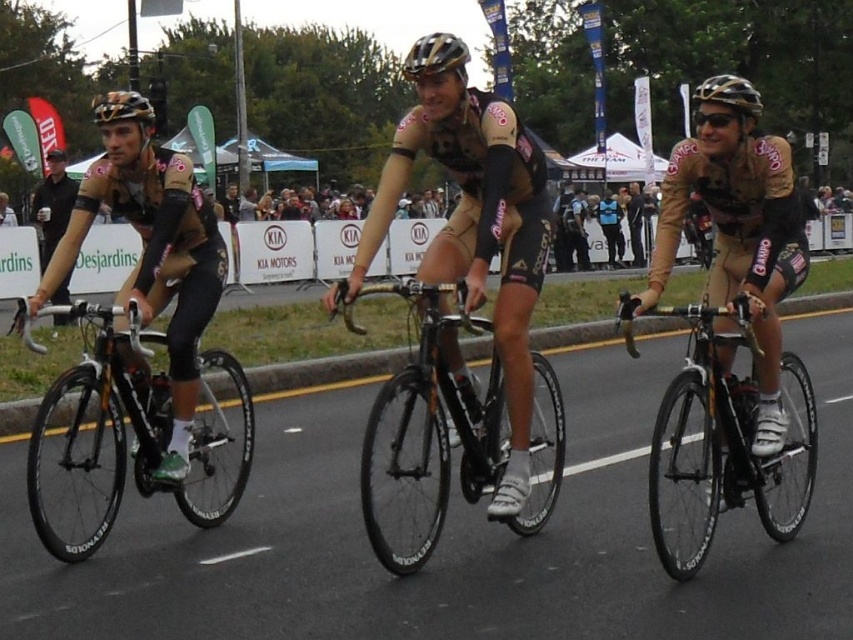
The width and height of the screenshot is (853, 640). What do you see at coordinates (433, 420) in the screenshot?
I see `black matte bicycle at center` at bounding box center [433, 420].

Is black matte bicycle at center closer to camera compared to matte black helmet at left?

Yes, it is in front of matte black helmet at left.

Where is `black matte bicycle at center`? black matte bicycle at center is located at coordinates (433, 420).

Which is below, gold metallic helmet at center or gold metallic helmet at upper left?

gold metallic helmet at center is below.

Does gold metallic helmet at center have a lesser height compared to gold metallic helmet at upper left?

Yes.

Between point (448, 49) and point (134, 118), which one is positioned behind?

Positioned behind is point (134, 118).

Find the location of a particular element. gold metallic helmet at center is located at coordinates (438, 74).

Does shiny gold bicycle at center appear over gold metallic helmet at center?

Actually, shiny gold bicycle at center is below gold metallic helmet at center.

Who is positioned more to the right, shiny gold bicycle at center or gold metallic helmet at center?

Positioned to the right is shiny gold bicycle at center.

Who is more forward, (x=709, y=456) or (x=444, y=90)?

Point (x=444, y=90) is more forward.

I want to click on shiny gold bicycle at center, so click(x=724, y=433).